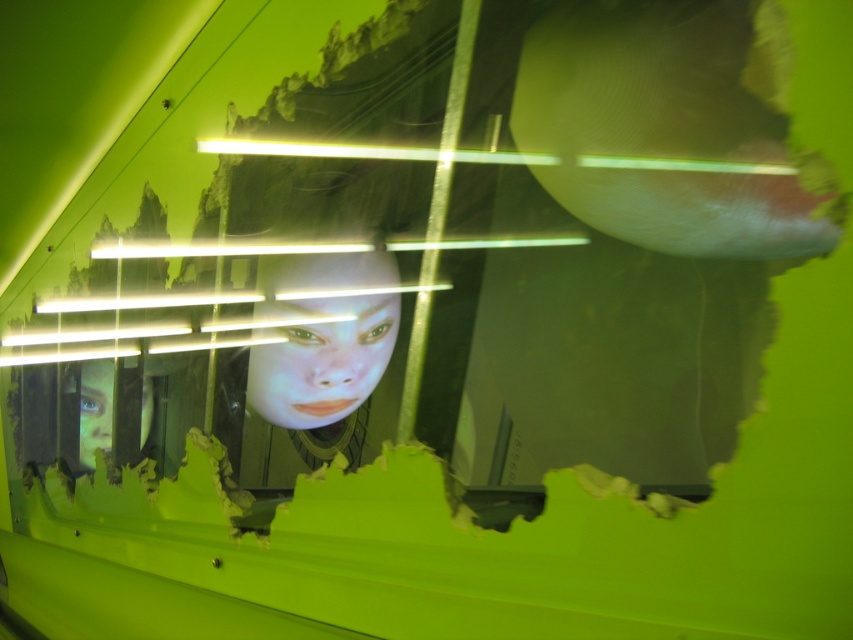
You are navigating through a virtual reality simulation and see two points marked in the scene. The first point is at coordinates point(337, 266) and the second is at point(151, 400). Which point is closer to you, the observer?

Point(337, 266) is in front of point(151, 400), so it is closer to you.

You are an observer in the scene. You notice two faces in front of you. The first is the smooth skin face at center, and the second is the smooth green face at left. Which face is closer to you?

The smooth skin face at center is closer to you because it is in front of the smooth green face at left.